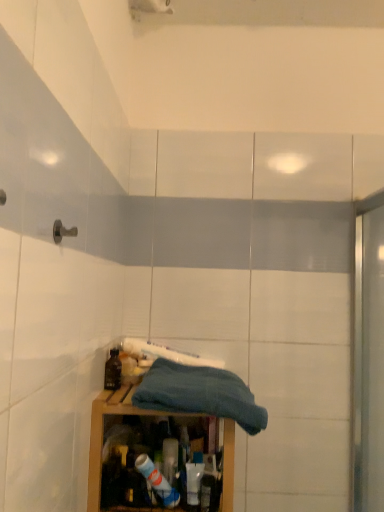
Question: Could you tell me if wooden cabinet at lower center is turned towards blue cotton towel at center?

Choices:
 (A) yes
 (B) no

Answer: (B)

Question: Is wooden cabinet at lower center completely or partially outside of blue cotton towel at center?

Choices:
 (A) no
 (B) yes

Answer: (B)

Question: Is wooden cabinet at lower center shorter than blue cotton towel at center?

Choices:
 (A) no
 (B) yes

Answer: (A)

Question: Can blue cotton towel at center be found inside wooden cabinet at lower center?

Choices:
 (A) yes
 (B) no

Answer: (B)

Question: From a real-world perspective, is wooden cabinet at lower center under blue cotton towel at center?

Choices:
 (A) no
 (B) yes

Answer: (B)

Question: From the image's perspective, is wooden cabinet at lower center on top of blue cotton towel at center?

Choices:
 (A) no
 (B) yes

Answer: (A)

Question: Is matte black bottle at lower left facing towards wooden cabinet at lower center?

Choices:
 (A) no
 (B) yes

Answer: (A)

Question: Does matte black bottle at lower left have a larger size compared to wooden cabinet at lower center?

Choices:
 (A) yes
 (B) no

Answer: (B)

Question: From the image's perspective, is matte black bottle at lower left below wooden cabinet at lower center?

Choices:
 (A) yes
 (B) no

Answer: (B)

Question: Is matte black bottle at lower left thinner than wooden cabinet at lower center?

Choices:
 (A) no
 (B) yes

Answer: (B)

Question: Can you confirm if matte black bottle at lower left is taller than wooden cabinet at lower center?

Choices:
 (A) no
 (B) yes

Answer: (A)

Question: From a real-world perspective, is matte black bottle at lower left physically below wooden cabinet at lower center?

Choices:
 (A) yes
 (B) no

Answer: (B)

Question: Does wooden cabinet at lower center have a smaller size compared to matte black bottle at lower left?

Choices:
 (A) yes
 (B) no

Answer: (B)